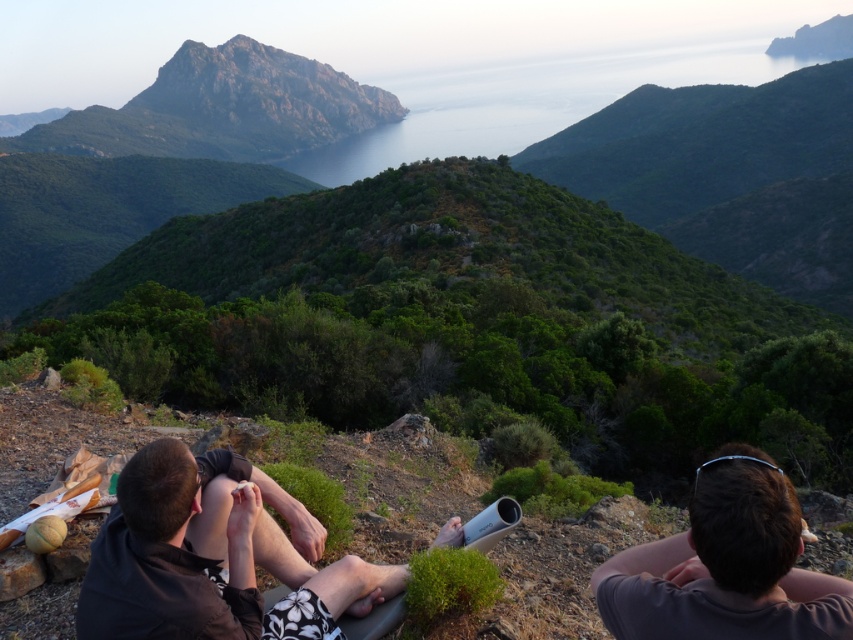
In the scene shown: You are standing at the base of the rugged stone peak at upper center and want to move towards the dark brown leather jacket at lower left. Which direction should you head?

The dark brown leather jacket at lower left is positioned on the right side of rugged stone peak at upper center, so you should head to the right to reach it.

You are standing at the point with coordinates point (196, 56) and want to walk to the point with coordinates point (601, 605). Which direction should you move in?

You should move forward because point (601, 605) is in front of point (196, 56).

You are standing at the base of the rocky outcrop and want to approach the two people sitting on the rocks. Which object would you encounter first as you climb up the rocks? The dark brown leather jacket at lower left or the brown hair at center?

The dark brown leather jacket at lower left is closer to you, so you would encounter it first as you climb up the rocks.